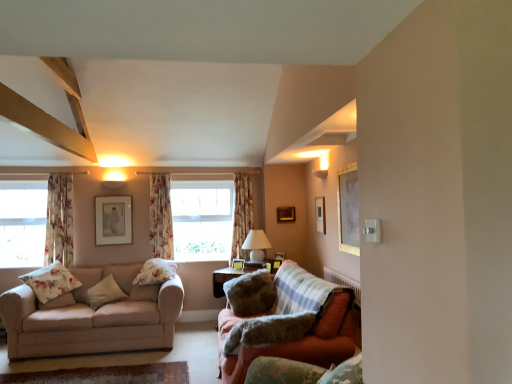
Question: Is fluffy beige pillow at center, which is counted as the 5th pillow, starting from the left, in front of velvet green armchair at lower right?

Choices:
 (A) no
 (B) yes

Answer: (A)

Question: Is fluffy beige pillow at center, the second pillow viewed from the right, turned away from velvet green armchair at lower right?

Choices:
 (A) yes
 (B) no

Answer: (B)

Question: Is fluffy beige pillow at center, which is counted as the 5th pillow, starting from the left, bigger than velvet green armchair at lower right?

Choices:
 (A) no
 (B) yes

Answer: (B)

Question: Can you confirm if fluffy beige pillow at center, which is counted as the 5th pillow, starting from the left, is positioned to the left of velvet green armchair at lower right?

Choices:
 (A) no
 (B) yes

Answer: (B)

Question: From a real-world perspective, is fluffy beige pillow at center, which is counted as the 5th pillow, starting from the left, on top of velvet green armchair at lower right?

Choices:
 (A) no
 (B) yes

Answer: (A)

Question: Considering the relative sizes of fluffy beige pillow at center, the second pillow viewed from the right, and velvet green armchair at lower right in the image provided, is fluffy beige pillow at center, the second pillow viewed from the right, wider than velvet green armchair at lower right?

Choices:
 (A) no
 (B) yes

Answer: (B)

Question: From a real-world perspective, is fluffy beige pillow at center, the second pillow viewed from the right, on top of floral fabric pillow at center, the third pillow from the right?

Choices:
 (A) yes
 (B) no

Answer: (B)

Question: From the image's perspective, is fluffy beige pillow at center, which is counted as the 5th pillow, starting from the left, located beneath floral fabric pillow at center, the third pillow from the right?

Choices:
 (A) yes
 (B) no

Answer: (A)

Question: From the image's perspective, is fluffy beige pillow at center, the second pillow viewed from the right, above floral fabric pillow at center, arranged as the fourth pillow when viewed from the left?

Choices:
 (A) no
 (B) yes

Answer: (A)

Question: Does fluffy beige pillow at center, which is counted as the 5th pillow, starting from the left, have a lesser width compared to floral fabric pillow at center, arranged as the fourth pillow when viewed from the left?

Choices:
 (A) yes
 (B) no

Answer: (B)

Question: Is fluffy beige pillow at center, which is counted as the 5th pillow, starting from the left, oriented away from floral fabric pillow at center, arranged as the fourth pillow when viewed from the left?

Choices:
 (A) no
 (B) yes

Answer: (A)

Question: Is there a large distance between fluffy beige pillow at center, the second pillow viewed from the right, and floral fabric pillow at center, the third pillow from the right?

Choices:
 (A) yes
 (B) no

Answer: (B)

Question: Is velvet green armchair at lower right bigger than fluffy beige pillow at left, the fifth pillow positioned from the right?

Choices:
 (A) no
 (B) yes

Answer: (B)